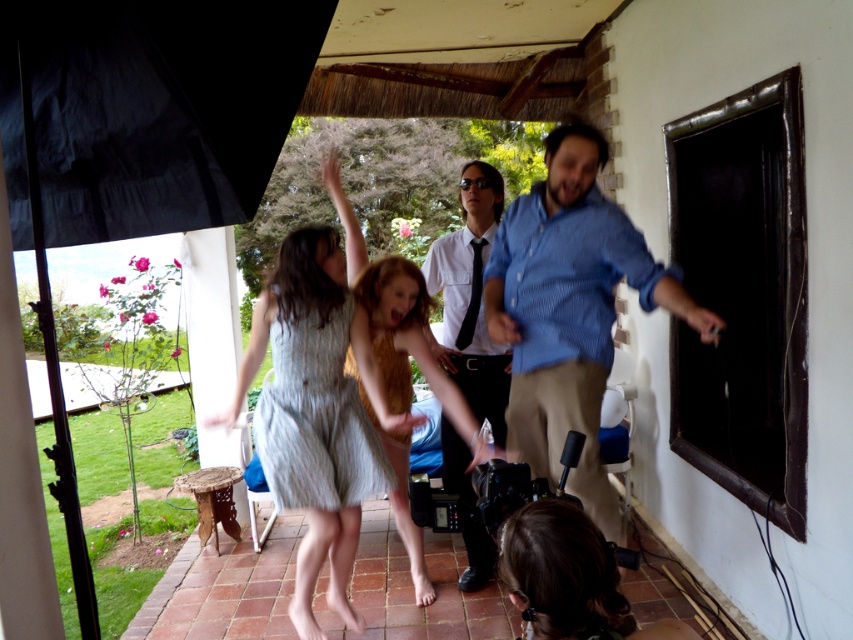
Does point (381, 374) lie behind point (396, 388)?

No, (381, 374) is closer to viewer.

Does light brown hair at center have a lesser width compared to light blue textured dress at center?

In fact, light brown hair at center might be wider than light blue textured dress at center.

Who is more distant from viewer, (404, 500) or (383, 371)?

Point (404, 500)

Where is `light brown hair at center`? light brown hair at center is located at coordinates (410, 342).

Which of these two, blue striped shirt at center or light brown hair at center, stands taller?

With more height is light brown hair at center.

Can you confirm if blue striped shirt at center is wider than light brown hair at center?

Yes.

Where is `blue striped shirt at center`? The height and width of the screenshot is (640, 853). blue striped shirt at center is located at coordinates (570, 310).

I want to click on blue striped shirt at center, so click(570, 310).

Is white shirt at center wider than light blue textured dress at center?

Yes, white shirt at center is wider than light blue textured dress at center.

Describe the element at coordinates (469, 298) in the screenshot. This screenshot has height=640, width=853. I see `white shirt at center` at that location.

Where is `white shirt at center`? This screenshot has width=853, height=640. white shirt at center is located at coordinates (469, 298).